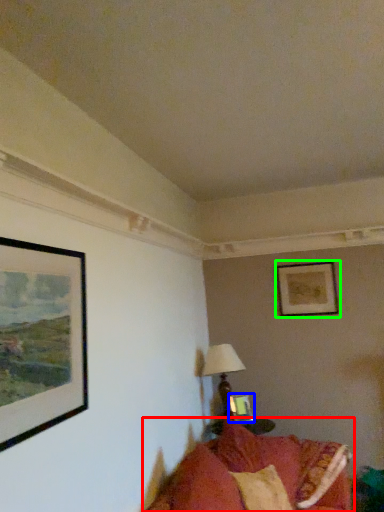
Question: Which object is positioned closest to studio couch (highlighted by a red box)? Select from picture frame (highlighted by a blue box) and picture frame (highlighted by a green box).

Choices:
 (A) picture frame
 (B) picture frame

Answer: (A)